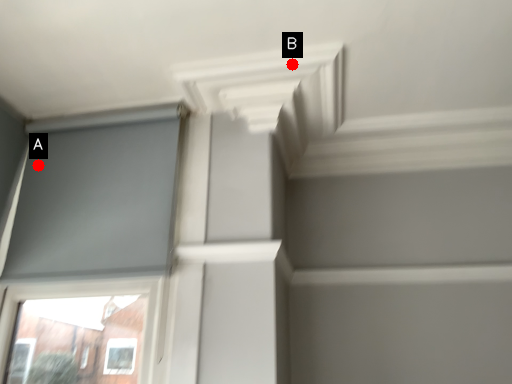
Question: Two points are circled on the image, labeled by A and B beside each circle. Which point is further to the camera?

Choices:
 (A) A is further
 (B) B is further

Answer: (A)